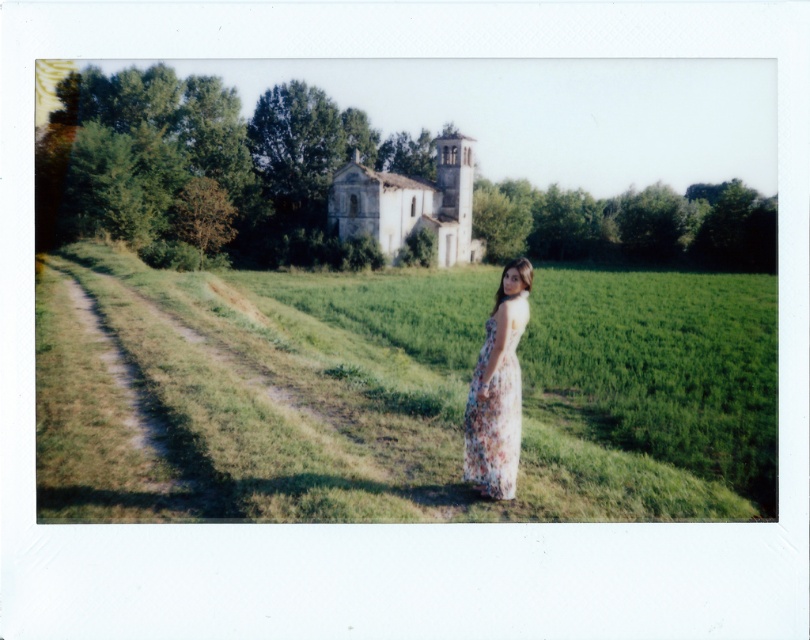
Question: Does green grass at center appear under floral cotton dress at center?

Choices:
 (A) yes
 (B) no

Answer: (A)

Question: Where is green grass at center located in relation to floral cotton dress at center in the image?

Choices:
 (A) above
 (B) below

Answer: (B)

Question: Among these points, which one is nearest to the camera?

Choices:
 (A) (478, 413)
 (B) (538, 284)

Answer: (A)

Question: Is green grass at center positioned behind floral cotton dress at center?

Choices:
 (A) no
 (B) yes

Answer: (A)